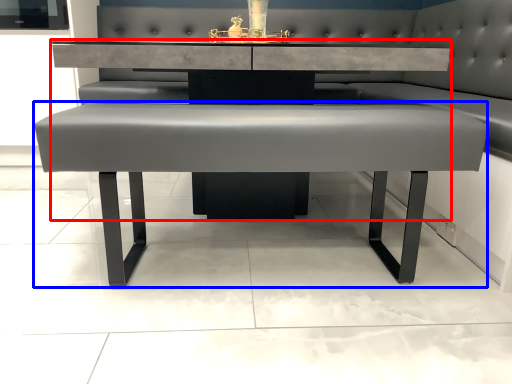
Question: Which of the following is the closest to the observer, table (highlighted by a red box) or table (highlighted by a blue box)?

Choices:
 (A) table
 (B) table

Answer: (B)